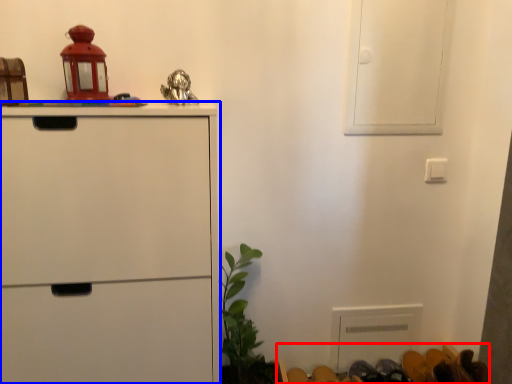
Question: Which point is further to the camera, furniture (highlighted by a red box) or chest of drawers (highlighted by a blue box)?

Choices:
 (A) furniture
 (B) chest of drawers

Answer: (A)